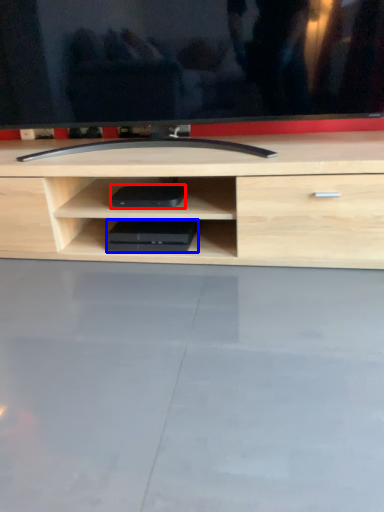
Question: Among these objects, which one is nearest to the camera, equipment (highlighted by a red box) or equipment (highlighted by a blue box)?

Choices:
 (A) equipment
 (B) equipment

Answer: (A)